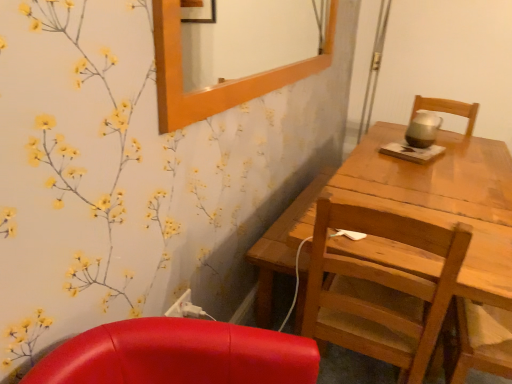
The width and height of the screenshot is (512, 384). Describe the element at coordinates (380, 289) in the screenshot. I see `wooden chair at right` at that location.

Describe the element at coordinates (423, 129) in the screenshot. I see `gold metallic teapot at upper right` at that location.

Locate an element on the screen. This screenshot has height=384, width=512. wooden chair at right is located at coordinates (x=380, y=289).

Does wooden frame at upper center appear on the left side of white plastic power outlet at lower center?

No.

How much distance is there between wooden frame at upper center and white plastic power outlet at lower center?

The distance of wooden frame at upper center from white plastic power outlet at lower center is 2.71 meters.

From a real-world perspective, which object stands above the other?

In real-world perspective, wooden frame at upper center is above.

Locate an element on the screen. The width and height of the screenshot is (512, 384). power outlet below the wooden frame at upper center (from a real-world perspective) is located at coordinates (180, 305).

Which is correct: gold metallic teapot at upper right is inside white plastic power outlet at lower center, or outside of it?

gold metallic teapot at upper right is spatially situated outside white plastic power outlet at lower center.

What's the angular difference between gold metallic teapot at upper right and white plastic power outlet at lower center's facing directions?

The facing directions of gold metallic teapot at upper right and white plastic power outlet at lower center are 18.5 degrees apart.

Which object is thinner, gold metallic teapot at upper right or white plastic power outlet at lower center?

white plastic power outlet at lower center.

Is gold metallic teapot at upper right positioned behind white plastic power outlet at lower center?

Yes, gold metallic teapot at upper right is further from the viewer.

In terms of height, does gold metallic teapot at upper right look taller or shorter compared to wooden chair at right?

In the image, gold metallic teapot at upper right appears to be shorter than wooden chair at right.

From a real-world perspective, which is physically below, gold metallic teapot at upper right or wooden chair at right?

wooden chair at right is physically lower.

In the scene shown: Is gold metallic teapot at upper right positioned far away from wooden chair at right?

gold metallic teapot at upper right is far away from wooden chair at right.

Considering the sizes of objects gold metallic teapot at upper right and wooden chair at right in the image provided, who is thinner, gold metallic teapot at upper right or wooden chair at right?

gold metallic teapot at upper right.

Which object is further away from the camera, wooden chair at right or wooden frame at upper center?

wooden chair at right is more distant.

Considering the positions of objects wooden chair at right and wooden frame at upper center in the image provided, who is more to the left, wooden chair at right or wooden frame at upper center?

From the viewer's perspective, wooden frame at upper center appears more on the left side.

Does point (323, 332) appear closer or farther from the camera than point (277, 14)?

Point (323, 332) is closer to the camera than point (277, 14).

Is wooden chair at right looking in the opposite direction of gold metallic teapot at upper right?

That's not correct — wooden chair at right is not looking away from gold metallic teapot at upper right.

Which is behind, point (324, 272) or point (424, 111)?

The point (424, 111) is farther.

Is wooden chair at right next to gold metallic teapot at upper right?

wooden chair at right is not next to gold metallic teapot at upper right, and they're not touching.

Which point is more distant from viewer, (294, 31) or (429, 131)?

The point (294, 31) is farther from the camera.

Is wooden frame at upper center turned away from gold metallic teapot at upper right?

No, wooden frame at upper center's orientation is not away from gold metallic teapot at upper right.

From a real-world perspective, which object stands above the other?

wooden frame at upper center is physically above.

Considering the sizes of wooden frame at upper center and gold metallic teapot at upper right in the image, is wooden frame at upper center wider or thinner than gold metallic teapot at upper right?

wooden frame at upper center is thinner than gold metallic teapot at upper right.

Is white plastic power outlet at lower center looking in the opposite direction of wooden chair at right?

white plastic power outlet at lower center does not have its back to wooden chair at right.

From the image's perspective, is white plastic power outlet at lower center on top of wooden chair at right?

Indeed, from the image's perspective, white plastic power outlet at lower center is shown above wooden chair at right.

Would you say white plastic power outlet at lower center is inside or outside wooden chair at right?

The correct answer is: outside.

Is white plastic power outlet at lower center taller or shorter than wooden chair at right?

Clearly, white plastic power outlet at lower center is shorter compared to wooden chair at right.

Where is `mirror above the white plastic power outlet at lower center (from a real-world perspective)`? mirror above the white plastic power outlet at lower center (from a real-world perspective) is located at coordinates (247, 39).

You are a GUI agent. You are given a task and a screenshot of the screen. Output one action in this format:
    pyautogui.click(x=<x>, y=<y>)
    Task: Click on the power outlet lying below the gold metallic teapot at upper right (from the image's perspective)
    
    Given the screenshot: What is the action you would take?
    click(180, 305)

Based on the photo, estimate the real-world distances between objects in this image. Which object is closer to gold metallic teapot at upper right, wooden chair at right or wooden frame at upper center?

wooden chair at right is positioned closer to the anchor gold metallic teapot at upper right.

In the scene shown: Based on their spatial positions, is gold metallic teapot at upper right or wooden frame at upper center closer to white plastic power outlet at lower center?

gold metallic teapot at upper right is closer to white plastic power outlet at lower center.

When comparing their distances from white plastic power outlet at lower center, does wooden chair at right or wooden frame at upper center seem closer?

wooden chair at right is closer to white plastic power outlet at lower center.

Which object lies further to the anchor point white plastic power outlet at lower center, gold metallic teapot at upper right or wooden chair at right?

gold metallic teapot at upper right is further to white plastic power outlet at lower center.

From the image, which object appears to be farther from wooden frame at upper center, white plastic power outlet at lower center or wooden chair at right?

Based on the image, white plastic power outlet at lower center appears to be further to wooden frame at upper center.

Looking at the image, which one is located closer to gold metallic teapot at upper right, wooden frame at upper center or wooden chair at right?

The object closer to gold metallic teapot at upper right is wooden chair at right.

When comparing their distances from wooden frame at upper center, does gold metallic teapot at upper right or wooden chair at right seem closer?

gold metallic teapot at upper right lies closer to wooden frame at upper center than the other object.

Based on their spatial positions, is white plastic power outlet at lower center or wooden chair at right closer to gold metallic teapot at upper right?

The object closer to gold metallic teapot at upper right is wooden chair at right.

You are a GUI agent. You are given a task and a screenshot of the screen. Output one action in this format:
    pyautogui.click(x=<x>, y=<y>)
    Task: Click on the chair between white plastic power outlet at lower center and gold metallic teapot at upper right in the horizontal direction
    This screenshot has height=384, width=512.
    Given the screenshot: What is the action you would take?
    pyautogui.click(x=380, y=289)

Image resolution: width=512 pixels, height=384 pixels. In order to click on chair positioned between wooden frame at upper center and gold metallic teapot at upper right from near to far in this screenshot , I will do [x=380, y=289].

In order to click on power outlet between wooden frame at upper center and wooden chair at right in the vertical direction in this screenshot , I will do `click(180, 305)`.

The width and height of the screenshot is (512, 384). I want to click on mirror located between white plastic power outlet at lower center and gold metallic teapot at upper right in the left-right direction, so click(247, 39).